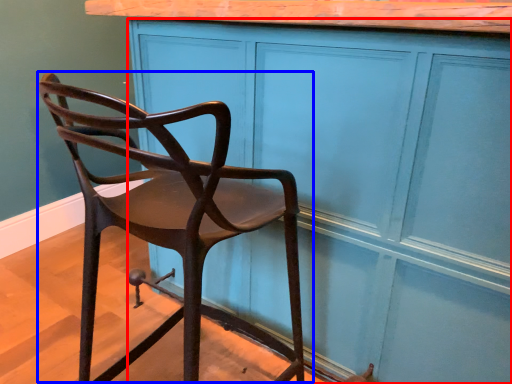
Question: Which point is further to the camera, cabinetry (highlighted by a red box) or chair (highlighted by a blue box)?

Choices:
 (A) cabinetry
 (B) chair

Answer: (A)